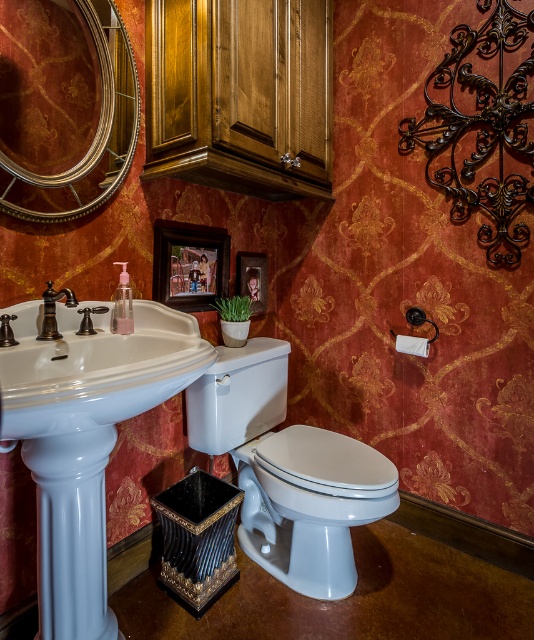
Question: Considering the relative positions of wooden picture frame at center and polished brass faucet at left in the image provided, where is wooden picture frame at center located with respect to polished brass faucet at left?

Choices:
 (A) below
 (B) above

Answer: (B)

Question: In this image, where is white glossy pedestal sink at left located relative to gold-framed mirror at upper left?

Choices:
 (A) above
 (B) below

Answer: (B)

Question: Estimate the real-world distances between objects in this image. Which object is farther from the gold-framed mirror at upper left?

Choices:
 (A) brown wooden picture frame at upper center
 (B) white glossy sink at lower left

Answer: (B)

Question: Which object is farther from the camera taking this photo?

Choices:
 (A) white glossy sink at lower left
 (B) brown wooden picture frame at upper center
 (C) gold-framed mirror at upper left
 (D) wooden picture frame at center

Answer: (D)

Question: Is white glossy toilet bowl at center smaller than wooden picture frame at center?

Choices:
 (A) yes
 (B) no

Answer: (B)

Question: Which of these objects is positioned closest to the white glossy sink at lower left?

Choices:
 (A) gold-framed mirror at upper left
 (B) polished brass faucet at left
 (C) white glossy toilet bowl at center
 (D) wooden picture frame at center

Answer: (B)